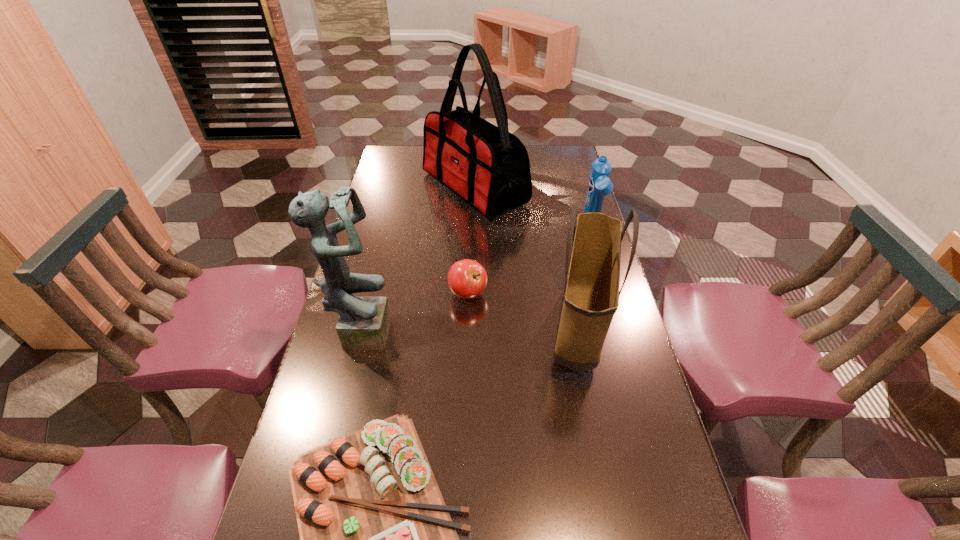
Find the location of a particular element. This screenshot has width=960, height=540. vacant region between the sculpture and the fifth tallest object is located at coordinates (415, 311).

The height and width of the screenshot is (540, 960). I want to click on free space between the shampoo and the duffel bag, so click(x=533, y=211).

Locate which object is the third closest to the shampoo. Please provide its 2D coordinates. Your answer should be formatted as a tuple, i.e. [(x, y)], where the tuple contains the x and y coordinates of a point satisfying the conditions above.

[(467, 279)]

Image resolution: width=960 pixels, height=540 pixels. In order to click on the fourth closest object to the tote bag in this screenshot , I will do `click(487, 166)`.

Locate an element on the screen. vacant position in the image that satisfies the following two spatial constraints: 1. on the back side of the fourth tallest object; 2. on the left side of the second shortest object is located at coordinates (469, 233).

Find the location of a particular element. This screenshot has height=540, width=960. vacant point that satisfies the following two spatial constraints: 1. on the face of the sculpture; 2. on the back side of the third tallest object is located at coordinates (361, 330).